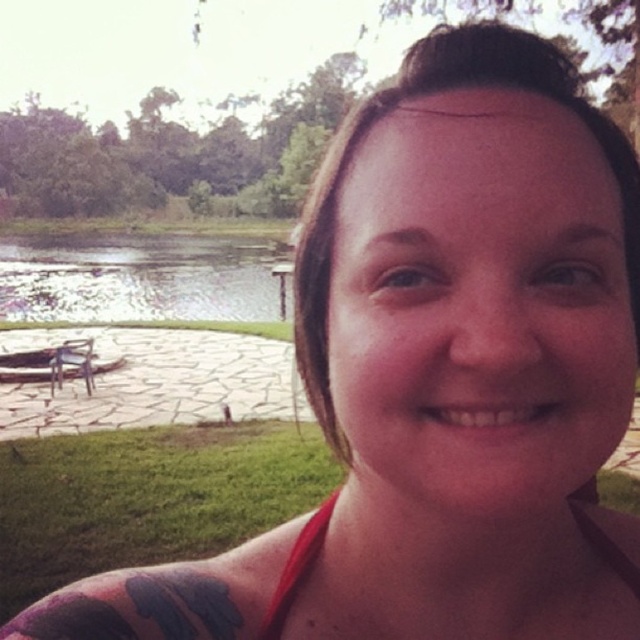
Based on the photo, you are a photographer wanting to capture the red fabric bikini top at lower center and the clear water at lake left in the same frame. Considering their sizes, which object will appear larger in the photo?

The clear water at lake left will appear larger in the photo because its width is larger than the red fabric bikini top at lower center.